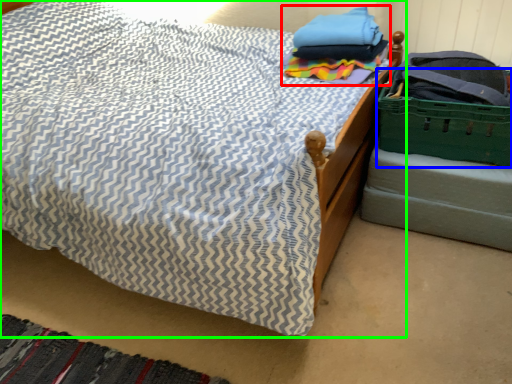
Question: Which object is the farthest from clothing (highlighted by a red box)? Choose among these: basket (highlighted by a blue box) or bed (highlighted by a green box).

Choices:
 (A) basket
 (B) bed

Answer: (B)